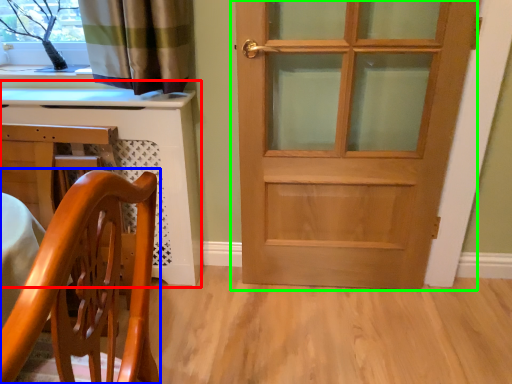
Question: Which object is positioned farthest from computer desk (highlighted by a red box)? Select from chair (highlighted by a blue box) and door (highlighted by a green box).

Choices:
 (A) chair
 (B) door

Answer: (A)